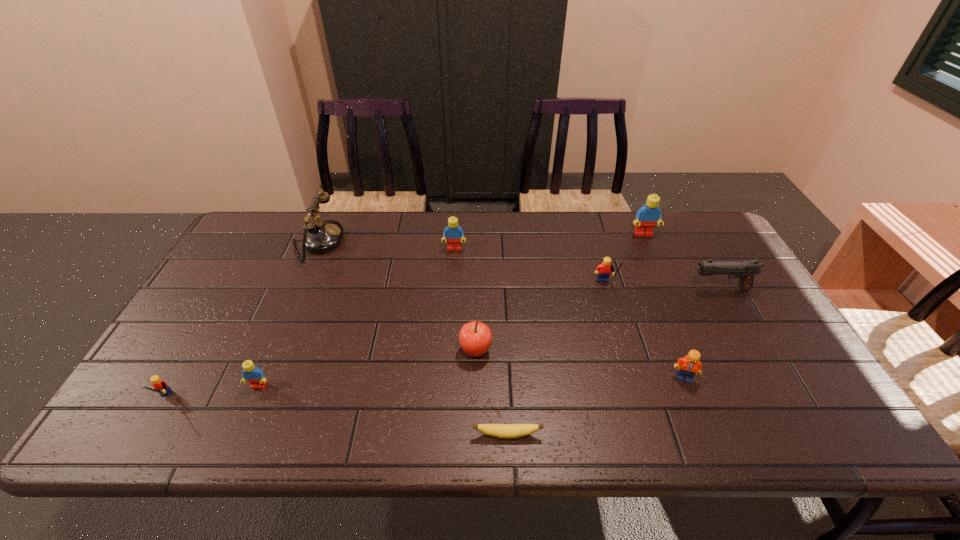
Locate an element on the screen. the farthest blue Lego is located at coordinates (647, 216).

Locate an element on the screen. the biggest blue Lego is located at coordinates (647, 216).

Find the location of `black telephone`. black telephone is located at coordinates (323, 236).

This screenshot has width=960, height=540. Identify the location of the fourth Lego from right to left. (453, 233).

You are a GUI agent. You are given a task and a screenshot of the screen. Output one action in this format:
    pyautogui.click(x=<x>, y=<y>)
    Task: Click on the second smallest blue Lego
    
    Given the screenshot: What is the action you would take?
    pyautogui.click(x=453, y=233)

At what (x,y) coordinates should I click in order to perform the action: click on the fourth nearest Lego. Please return your answer as a coordinate pair (x, y). The image size is (960, 540). Looking at the image, I should click on (603, 270).

Identify the location of the farther yellow Lego. (603, 270).

You are a GUI agent. You are given a task and a screenshot of the screen. Output one action in this format:
    pyautogui.click(x=<x>, y=<y>)
    Task: Click on the rightmost object
    
    Given the screenshot: What is the action you would take?
    pyautogui.click(x=744, y=270)

At what (x,y) coordinates should I click in order to perform the action: click on gray gun. Please return your answer as a coordinate pair (x, y). This screenshot has height=540, width=960. Looking at the image, I should click on (744, 270).

Locate an element on the screen. apple is located at coordinates (475, 338).